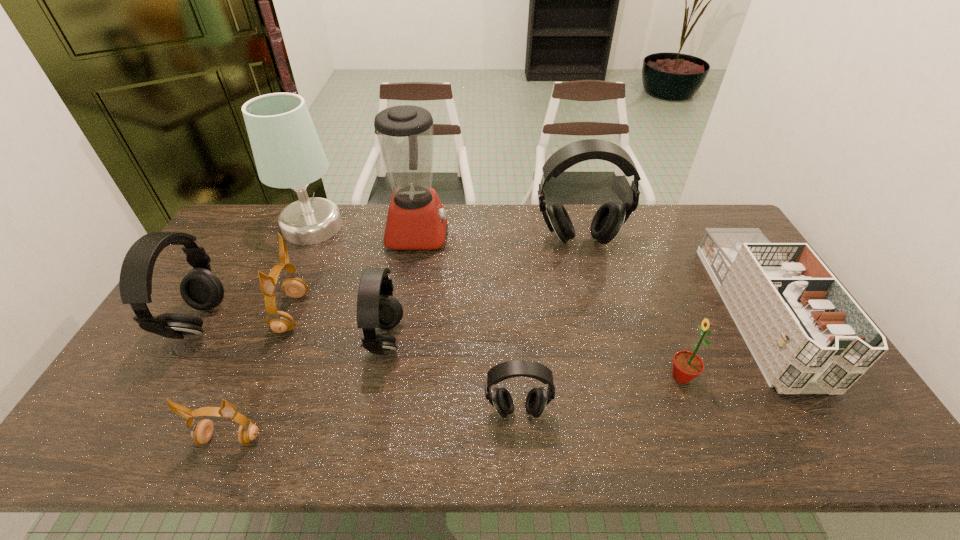
The image size is (960, 540). I want to click on free spot between the fifth earphone from left to right and the third smallest black earphone, so click(358, 367).

The image size is (960, 540). Identify the location of vacant area between the seventh shortest object and the green sunflower. (441, 350).

You are a GUI agent. You are given a task and a screenshot of the screen. Output one action in this format:
    pyautogui.click(x=<x>, y=<y>)
    Task: Click on the empty space between the fifth earphone from left to right and the lampshade
    
    Given the screenshot: What is the action you would take?
    pyautogui.click(x=415, y=319)

Find the location of `vacant point located between the lampshade and the nearest black earphone`. vacant point located between the lampshade and the nearest black earphone is located at coordinates tap(415, 319).

Select which object appears as the sixth closest to the second earphone from right to left. Please provide its 2D coordinates. Your answer should be formatted as a tuple, i.e. [(x, y)], where the tuple contains the x and y coordinates of a point satisfying the conditions above.

[(806, 333)]

Find the location of a particular element. Image resolution: width=960 pixels, height=540 pixels. object that is the seventh nearest to the bigger brown earphone is located at coordinates (608, 220).

Identify which earphone is located as the third nearest to the leftmost earphone. Please provide its 2D coordinates. Your answer should be formatted as a tuple, i.e. [(x, y)], where the tuple contains the x and y coordinates of a point satisfying the conditions above.

[(376, 307)]

Select which earphone is the fourth closest to the farther brown earphone. Please provide its 2D coordinates. Your answer should be formatted as a tuple, i.e. [(x, y)], where the tuple contains the x and y coordinates of a point satisfying the conditions above.

[(537, 399)]

Locate an element on the screen. The width and height of the screenshot is (960, 540). the third closest black earphone to the blender is located at coordinates (201, 289).

Where is `the second closest black earphone relative to the blender`? The width and height of the screenshot is (960, 540). the second closest black earphone relative to the blender is located at coordinates (x=608, y=220).